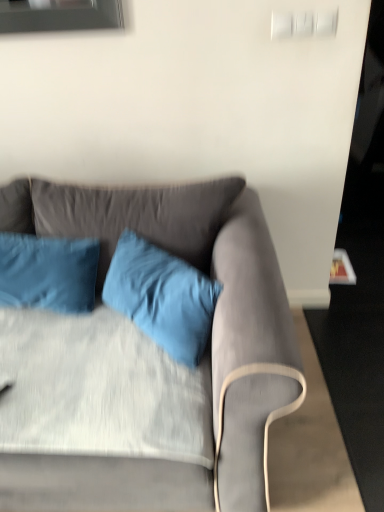
Question: Considering the positions of velvet blue pillow at center, the first pillow when ordered from right to left, and matte gray couch at center in the image, is velvet blue pillow at center, the first pillow when ordered from right to left, bigger or smaller than matte gray couch at center?

Choices:
 (A) big
 (B) small

Answer: (B)

Question: From a real-world perspective, is velvet blue pillow at center, which appears as the second pillow when viewed from the left, physically located above or below matte gray couch at center?

Choices:
 (A) below
 (B) above

Answer: (B)

Question: Which object is the closest to the blue satin pillow at left, the 2th pillow positioned from the right?

Choices:
 (A) matte gray couch at center
 (B) velvet blue pillow at center, the first pillow when ordered from right to left

Answer: (B)

Question: Which object is positioned closest to the blue satin pillow at left, which ranks as the 1th pillow in left-to-right order?

Choices:
 (A) velvet blue pillow at center, which appears as the second pillow when viewed from the left
 (B) matte gray couch at center

Answer: (A)